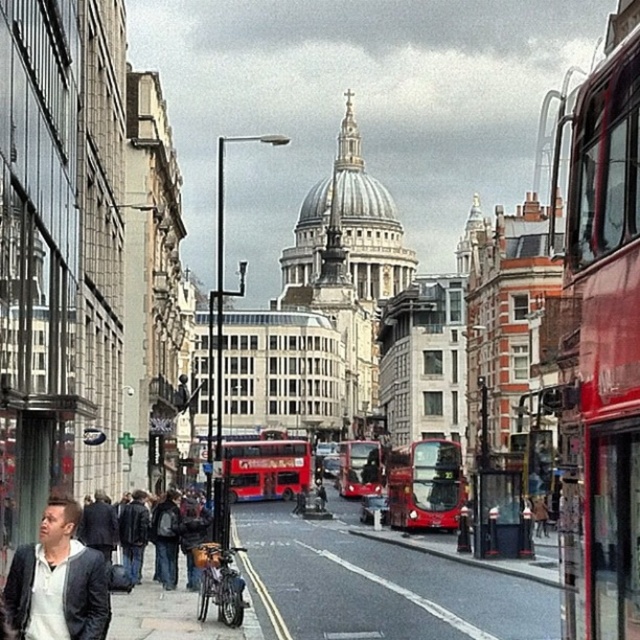
You are standing at point A, which is located at the coordinates (x=266, y=467). You want to walk to the red matte double decker bus at center. Which direction should you go?

The red matte double decker bus at center is located at point A, so you are already there.